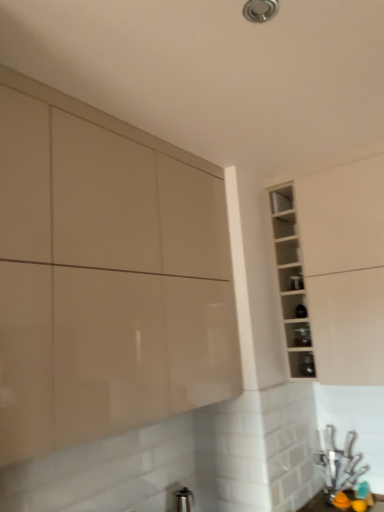
The width and height of the screenshot is (384, 512). I want to click on white glossy cabinet at upper right, which appears as the 2th cabinetry when viewed from the left, so click(x=337, y=267).

At what (x,y) coordinates should I click in order to perform the action: click on white glossy cabinet at upper right. Please return your answer as a coordinate pair (x, y). The height and width of the screenshot is (512, 384). Looking at the image, I should click on (291, 282).

The image size is (384, 512). What do you see at coordinates (281, 199) in the screenshot? I see `transparent glass shelf at upper right, which appears as the first shelf when viewed from the top` at bounding box center [281, 199].

Describe the element at coordinates (302, 364) in the screenshot. I see `clear glass shelf at upper right, arranged as the third shelf when viewed from the top` at that location.

Where is `glossy beige cabinet at upper left, arranged as the 1th cabinetry when viewed from the left`? The image size is (384, 512). glossy beige cabinet at upper left, arranged as the 1th cabinetry when viewed from the left is located at coordinates (106, 274).

The image size is (384, 512). Identify the location of cabinetry lying on the left of white glossy cabinet at upper right, the 1th cabinetry in the right-to-left sequence. (106, 274).

Considering the relative sizes of white glossy cabinet at upper right, the 1th cabinetry in the right-to-left sequence, and glossy beige cabinet at upper left, arranged as the 1th cabinetry when viewed from the left, in the image provided, is white glossy cabinet at upper right, the 1th cabinetry in the right-to-left sequence, taller than glossy beige cabinet at upper left, arranged as the 1th cabinetry when viewed from the left,?

Incorrect, the height of white glossy cabinet at upper right, the 1th cabinetry in the right-to-left sequence, is not larger of that of glossy beige cabinet at upper left, arranged as the 1th cabinetry when viewed from the left.

Which of these two, white glossy cabinet at upper right, which appears as the 2th cabinetry when viewed from the left, or glossy beige cabinet at upper left, placed as the 2th cabinetry when sorted from right to left, is bigger?

glossy beige cabinet at upper left, placed as the 2th cabinetry when sorted from right to left.

Is white glossy cabinet at upper right, which appears as the 2th cabinetry when viewed from the left, wider than glossy beige cabinet at upper left, placed as the 2th cabinetry when sorted from right to left?

Correct, the width of white glossy cabinet at upper right, which appears as the 2th cabinetry when viewed from the left, exceeds that of glossy beige cabinet at upper left, placed as the 2th cabinetry when sorted from right to left.

In the scene shown: Which object is positioned more to the left, transparent glass shelf at upper right, which appears as the 3th shelf when ordered from the bottom, or white glossy cabinet at upper right?

Positioned to the left is transparent glass shelf at upper right, which appears as the 3th shelf when ordered from the bottom.

Is white glossy cabinet at upper right at the back of transparent glass shelf at upper right, which appears as the first shelf when viewed from the top?

Yes, white glossy cabinet at upper right is at the back of transparent glass shelf at upper right, which appears as the first shelf when viewed from the top.

From a real-world perspective, is transparent glass shelf at upper right, which appears as the 3th shelf when ordered from the bottom, located beneath white glossy cabinet at upper right?

No.

From the image's perspective, is transparent glass shelf at upper right, which appears as the 3th shelf when ordered from the bottom, located above or below white glossy cabinet at upper right?

Clearly, from the image's perspective, transparent glass shelf at upper right, which appears as the 3th shelf when ordered from the bottom, is above white glossy cabinet at upper right.

Considering the sizes of objects transparent glass shelf at upper right, which appears as the 3th shelf when ordered from the bottom, and matte black shelf at center-right, placed as the second shelf when sorted from top to bottom, in the image provided, who is bigger, transparent glass shelf at upper right, which appears as the 3th shelf when ordered from the bottom, or matte black shelf at center-right, placed as the second shelf when sorted from top to bottom,?

matte black shelf at center-right, placed as the second shelf when sorted from top to bottom.

Would you consider transparent glass shelf at upper right, which appears as the 3th shelf when ordered from the bottom, to be distant from matte black shelf at center-right, placed as the second shelf when sorted from top to bottom?

No, there isn't a large distance between transparent glass shelf at upper right, which appears as the 3th shelf when ordered from the bottom, and matte black shelf at center-right, placed as the second shelf when sorted from top to bottom.

Between transparent glass shelf at upper right, which appears as the first shelf when viewed from the top, and matte black shelf at center-right, the 2th shelf in the bottom-to-top sequence, which one has larger width?

matte black shelf at center-right, the 2th shelf in the bottom-to-top sequence, is wider.

At what (x,y) coordinates should I click in order to perform the action: click on shelf that is the 1st one when counting rightward from the glossy beige cabinet at upper left, placed as the 2th cabinetry when sorted from right to left. Please return your answer as a coordinate pair (x, y). The width and height of the screenshot is (384, 512). Looking at the image, I should click on (281, 199).

Does transparent glass shelf at upper right, which appears as the first shelf when viewed from the top, have a smaller size compared to glossy beige cabinet at upper left, placed as the 2th cabinetry when sorted from right to left?

Yes.

Can you confirm if transparent glass shelf at upper right, which appears as the first shelf when viewed from the top, is shorter than glossy beige cabinet at upper left, placed as the 2th cabinetry when sorted from right to left?

Yes.

Which is more to the left, transparent glass shelf at upper right, which appears as the first shelf when viewed from the top, or glossy beige cabinet at upper left, arranged as the 1th cabinetry when viewed from the left?

glossy beige cabinet at upper left, arranged as the 1th cabinetry when viewed from the left, is more to the left.

Does white glossy cabinet at upper right contain transparent glass shelf at upper right, which appears as the first shelf when viewed from the top?

Yes, transparent glass shelf at upper right, which appears as the first shelf when viewed from the top, can be found within white glossy cabinet at upper right.

Measure the distance between white glossy cabinet at upper right and transparent glass shelf at upper right, which appears as the 3th shelf when ordered from the bottom.

They are 11.49 inches apart.

From the image's perspective, is white glossy cabinet at upper right above transparent glass shelf at upper right, which appears as the first shelf when viewed from the top?

No, from the image's perspective, white glossy cabinet at upper right is not over transparent glass shelf at upper right, which appears as the first shelf when viewed from the top.

Consider the image. Is glossy beige cabinet at upper left, placed as the 2th cabinetry when sorted from right to left, wider or thinner than matte black shelf at center-right, placed as the second shelf when sorted from top to bottom?

Clearly, glossy beige cabinet at upper left, placed as the 2th cabinetry when sorted from right to left, has more width compared to matte black shelf at center-right, placed as the second shelf when sorted from top to bottom.

In the scene shown: Is glossy beige cabinet at upper left, arranged as the 1th cabinetry when viewed from the left, closer to camera compared to matte black shelf at center-right, the 2th shelf in the bottom-to-top sequence?

That is True.

Is glossy beige cabinet at upper left, placed as the 2th cabinetry when sorted from right to left, completely or partially outside of matte black shelf at center-right, placed as the second shelf when sorted from top to bottom?

Absolutely, glossy beige cabinet at upper left, placed as the 2th cabinetry when sorted from right to left, is external to matte black shelf at center-right, placed as the second shelf when sorted from top to bottom.

Is matte black shelf at center-right, the 2th shelf in the bottom-to-top sequence, bigger than glossy beige cabinet at upper left, placed as the 2th cabinetry when sorted from right to left?

Incorrect, matte black shelf at center-right, the 2th shelf in the bottom-to-top sequence, is not larger than glossy beige cabinet at upper left, placed as the 2th cabinetry when sorted from right to left.

Considering the sizes of matte black shelf at center-right, placed as the second shelf when sorted from top to bottom, and glossy beige cabinet at upper left, arranged as the 1th cabinetry when viewed from the left, in the image, is matte black shelf at center-right, placed as the second shelf when sorted from top to bottom, taller or shorter than glossy beige cabinet at upper left, arranged as the 1th cabinetry when viewed from the left,?

Clearly, matte black shelf at center-right, placed as the second shelf when sorted from top to bottom, is shorter compared to glossy beige cabinet at upper left, arranged as the 1th cabinetry when viewed from the left.

Is matte black shelf at center-right, placed as the second shelf when sorted from top to bottom, in front of glossy beige cabinet at upper left, arranged as the 1th cabinetry when viewed from the left?

That is False.

Find the location of a particular element. Image resolution: width=384 pixels, height=512 pixels. cabinetry behind the glossy beige cabinet at upper left, placed as the 2th cabinetry when sorted from right to left is located at coordinates (337, 267).

Identify the location of cabinet in front of the transparent glass shelf at upper right, which appears as the 3th shelf when ordered from the bottom. (291, 282).

Which object lies further to the anchor point white glossy cabinet at upper right, which appears as the 2th cabinetry when viewed from the left, glossy beige cabinet at upper left, placed as the 2th cabinetry when sorted from right to left, or transparent glass shelf at upper right, which appears as the 3th shelf when ordered from the bottom?

glossy beige cabinet at upper left, placed as the 2th cabinetry when sorted from right to left, is further to white glossy cabinet at upper right, which appears as the 2th cabinetry when viewed from the left.

In the scene shown: Which object lies further to the anchor point white glossy cabinet at upper right, the 1th cabinetry in the right-to-left sequence, white glossy cabinet at upper right or glossy beige cabinet at upper left, arranged as the 1th cabinetry when viewed from the left?

glossy beige cabinet at upper left, arranged as the 1th cabinetry when viewed from the left, lies further to white glossy cabinet at upper right, the 1th cabinetry in the right-to-left sequence, than the other object.

When comparing their distances from clear glass shelf at upper right, arranged as the third shelf when viewed from the top, does white glossy cabinet at upper right, the 1th cabinetry in the right-to-left sequence, or transparent glass shelf at upper right, which appears as the first shelf when viewed from the top, seem further?

transparent glass shelf at upper right, which appears as the first shelf when viewed from the top, is positioned further to the anchor clear glass shelf at upper right, arranged as the third shelf when viewed from the top.

Looking at the image, which one is located further to white glossy cabinet at upper right, white glossy cabinet at upper right, the 1th cabinetry in the right-to-left sequence, or clear glass shelf at upper right, arranged as the third shelf when viewed from the top?

Based on the image, clear glass shelf at upper right, arranged as the third shelf when viewed from the top, appears to be further to white glossy cabinet at upper right.

Based on the photo, considering their positions, is white glossy cabinet at upper right, which appears as the 2th cabinetry when viewed from the left, positioned further to white glossy cabinet at upper right than transparent glass shelf at upper right, which appears as the first shelf when viewed from the top?

transparent glass shelf at upper right, which appears as the first shelf when viewed from the top, is further to white glossy cabinet at upper right.

Based on their spatial positions, is matte black shelf at center-right, the 2th shelf in the bottom-to-top sequence, or glossy beige cabinet at upper left, arranged as the 1th cabinetry when viewed from the left, further from clear glass shelf at upper right, arranged as the third shelf when viewed from the top?

glossy beige cabinet at upper left, arranged as the 1th cabinetry when viewed from the left, is further to clear glass shelf at upper right, arranged as the third shelf when viewed from the top.

Estimate the real-world distances between objects in this image. Which object is closer to white glossy cabinet at upper right, glossy beige cabinet at upper left, placed as the 2th cabinetry when sorted from right to left, or clear glass shelf at upper right, arranged as the third shelf when viewed from the top?

The object closer to white glossy cabinet at upper right is clear glass shelf at upper right, arranged as the third shelf when viewed from the top.

From the picture: Which object lies nearer to the anchor point clear glass shelf at upper right, marked as the first shelf in a bottom-to-top arrangement, white glossy cabinet at upper right, which appears as the 2th cabinetry when viewed from the left, or matte black shelf at center-right, placed as the second shelf when sorted from top to bottom?

Based on the image, matte black shelf at center-right, placed as the second shelf when sorted from top to bottom, appears to be nearer to clear glass shelf at upper right, marked as the first shelf in a bottom-to-top arrangement.

In order to click on cabinet between transparent glass shelf at upper right, which appears as the first shelf when viewed from the top, and matte black shelf at center-right, placed as the second shelf when sorted from top to bottom, in the up-down direction in this screenshot , I will do `click(291, 282)`.

In order to click on cabinet located between white glossy cabinet at upper right, which appears as the 2th cabinetry when viewed from the left, and transparent glass shelf at upper right, which appears as the first shelf when viewed from the top, in the depth direction in this screenshot , I will do coord(291,282).

The width and height of the screenshot is (384, 512). I want to click on cabinet positioned between glossy beige cabinet at upper left, placed as the 2th cabinetry when sorted from right to left, and clear glass shelf at upper right, arranged as the third shelf when viewed from the top, from near to far, so click(291, 282).

Find the location of a particular element. cabinet between white glossy cabinet at upper right, the 1th cabinetry in the right-to-left sequence, and clear glass shelf at upper right, marked as the first shelf in a bottom-to-top arrangement, from top to bottom is located at coordinates (291, 282).